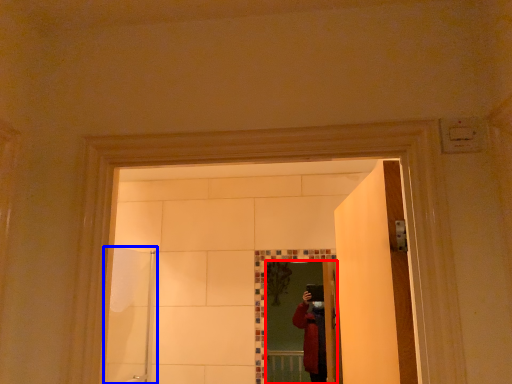
Question: Among these objects, which one is farthest to the camera, mirror (highlighted by a red box) or shower door (highlighted by a blue box)?

Choices:
 (A) mirror
 (B) shower door

Answer: (A)